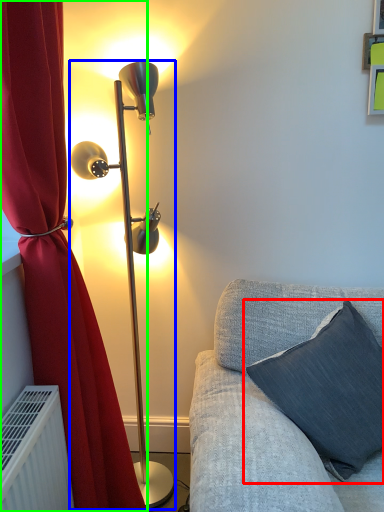
Question: Based on their relative distances, which object is farther from pillow (highlighted by a red box)? Choose from lamp (highlighted by a blue box) and curtain (highlighted by a green box).

Choices:
 (A) lamp
 (B) curtain

Answer: (A)